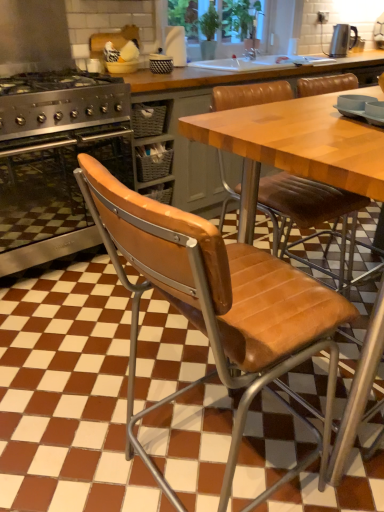
Question: From the image's perspective, is wooden table at center above or below metallic silver kettle at upper right?

Choices:
 (A) above
 (B) below

Answer: (B)

Question: Considering the positions of point (322, 170) and point (344, 34), is point (322, 170) closer or farther from the camera than point (344, 34)?

Choices:
 (A) farther
 (B) closer

Answer: (B)

Question: Based on their relative distances, which object is nearer to the brown leather chair at center?

Choices:
 (A) wooden table at center
 (B) stainless steel oven at left
 (C) metallic silver kettle at upper right

Answer: (A)

Question: Considering the real-world distances, which object is closest to the brown leather chair at center?

Choices:
 (A) stainless steel oven at left
 (B) wooden table at center
 (C) metallic silver kettle at upper right

Answer: (B)